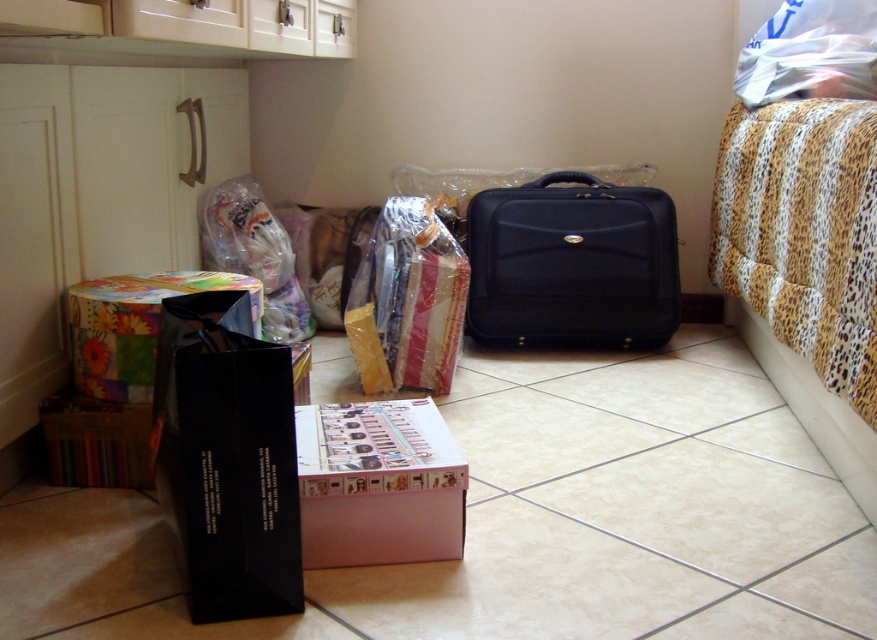
You are standing in the room and want to place a new box between the two points, point(569, 196) and point(241, 196). Which point should the box be closer to in order to be placed between them?

The box should be closer to point(241, 196) because point(569, 196) is in front of point(241, 196), meaning it is closer to the observer. To place the box between them, it needs to be positioned closer to the farther point, point(241, 196).

You are organizing a small event and need to place a new item between the leopard print fabric bed at right and the matte black briefcase at center. Is there enough space to place it there?

The leopard print fabric bed at right is to the right of the matte black briefcase at center, so there is space between them to place the new item.

You are organizing items in the room and need to place the matte black briefcase at center and the translucent plastic bag at upper left into storage. If the storage container can only hold items smaller than the briefcase, which item should you prioritize placing first?

The translucent plastic bag at upper left should be placed first since it is smaller than the matte black briefcase at center, which cannot fit into the storage container.